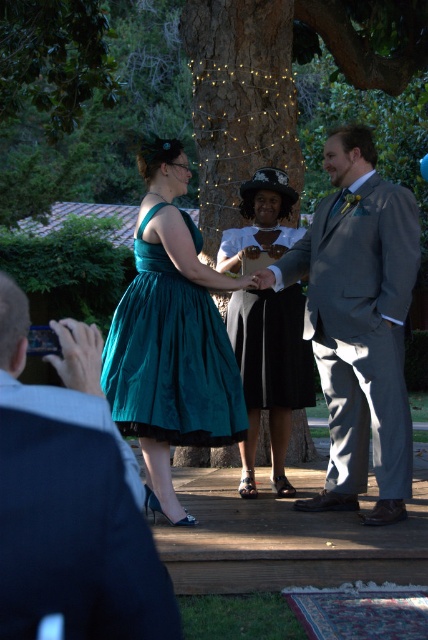
Question: Among these objects, which one is nearest to the camera?

Choices:
 (A) teal satin dress at center
 (B) smooth skin hand at lower left
 (C) velvet teal dress at center

Answer: (B)

Question: Which point appears closest to the camera in this image?

Choices:
 (A) (299, 323)
 (B) (362, 417)

Answer: (B)

Question: Which is nearer to the matte gray suit at center?

Choices:
 (A) gray suit at center
 (B) smooth skin hand at lower left

Answer: (B)

Question: Can you confirm if matte gray suit at center is smaller than smooth skin hand at lower left?

Choices:
 (A) yes
 (B) no

Answer: (B)

Question: Is gray suit at center closer to the viewer compared to smooth skin hand at lower left?

Choices:
 (A) no
 (B) yes

Answer: (A)

Question: Can you confirm if matte gray suit at center is wider than smooth skin hand at lower left?

Choices:
 (A) yes
 (B) no

Answer: (A)